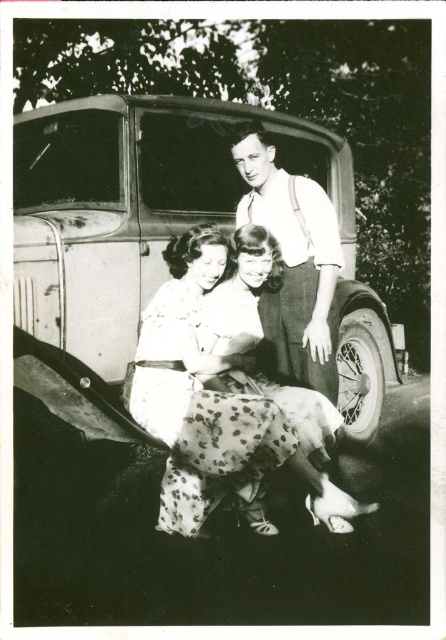
Question: Does metallic vintage car at center have a greater width compared to dotted fabric skirt at center?

Choices:
 (A) no
 (B) yes

Answer: (B)

Question: Which of these objects is positioned closest to the metallic vintage car at center?

Choices:
 (A) dotted fabric skirt at center
 (B) white cotton shirt at upper center
 (C) floral-patterned dress at center

Answer: (B)

Question: Considering the relative positions of floral-patterned dress at center and dotted fabric skirt at center in the image provided, where is floral-patterned dress at center located with respect to dotted fabric skirt at center?

Choices:
 (A) left
 (B) right

Answer: (A)

Question: Is metallic vintage car at center bigger than dotted fabric skirt at center?

Choices:
 (A) no
 (B) yes

Answer: (B)

Question: Which object is the farthest from the metallic vintage car at center?

Choices:
 (A) floral-patterned dress at center
 (B) dotted fabric skirt at center

Answer: (B)

Question: Among these objects, which one is nearest to the camera?

Choices:
 (A) metallic vintage car at center
 (B) dotted fabric skirt at center
 (C) floral-patterned dress at center

Answer: (A)